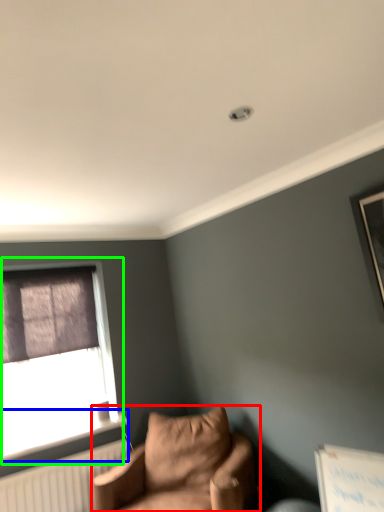
Question: Considering the real-world distances, which object is farthest from studio couch (highlighted by a red box)? window sill (highlighted by a blue box) or window (highlighted by a green box)?

Choices:
 (A) window sill
 (B) window

Answer: (B)